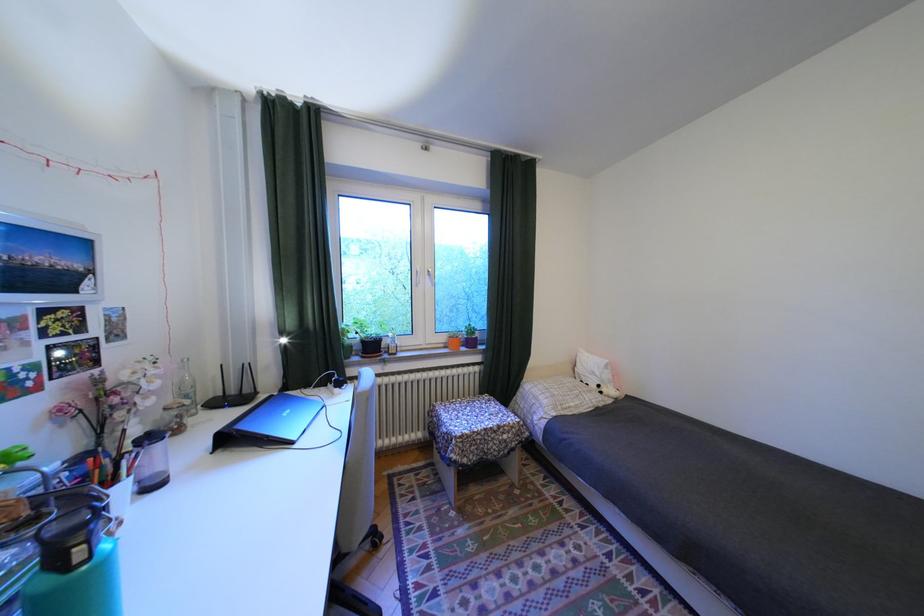
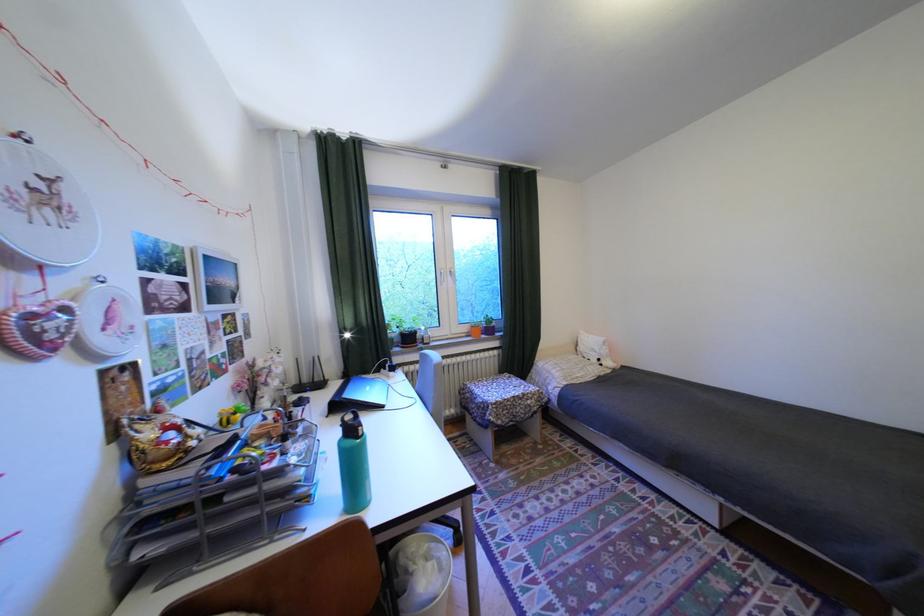
Where in the second image is the point corresponding to the point at 429,286 from the first image?

(454, 285)